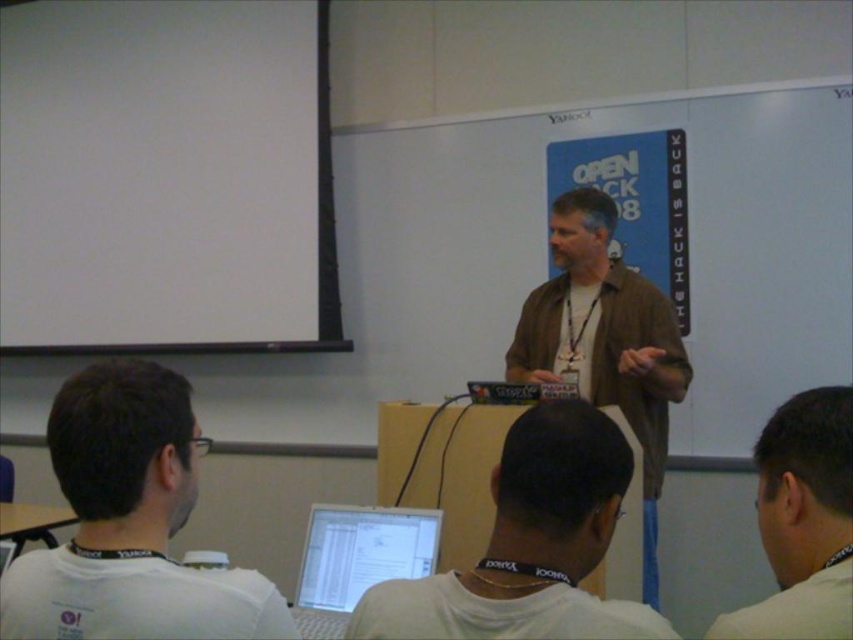
Question: Based on their relative distances, which object is nearer to the white lanyard at upper right?

Choices:
 (A) brown casual shirt at center
 (B) white matte shirt at lower left
 (C) white matte projection screen at upper left

Answer: (B)

Question: Does brown casual shirt at center lie in front of white lanyard at upper right?

Choices:
 (A) no
 (B) yes

Answer: (A)

Question: Which point is farther to the camera?

Choices:
 (A) white glossy laptop at center
 (B) white lanyard at upper right

Answer: (A)

Question: Does white glossy laptop at center appear under brown casual shirt at center?

Choices:
 (A) no
 (B) yes

Answer: (B)

Question: Considering the relative positions of white matte shirt at lower left and brown casual shirt at center in the image provided, where is white matte shirt at lower left located with respect to brown casual shirt at center?

Choices:
 (A) left
 (B) right

Answer: (A)

Question: Which point is closer to the camera taking this photo?

Choices:
 (A) (x=582, y=275)
 (B) (x=28, y=205)

Answer: (A)